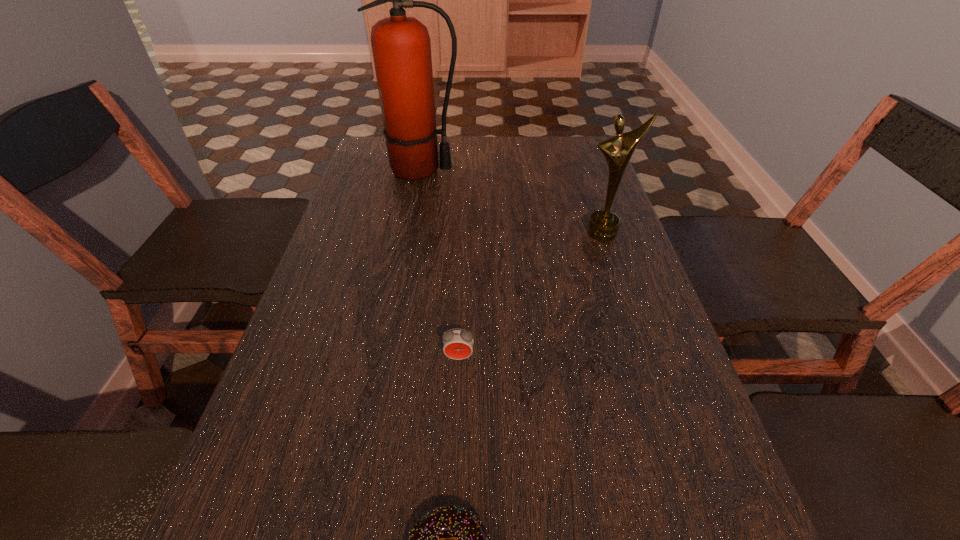
Where is `unoccupied position between the fire extinguisher and the alarm clock`? This screenshot has width=960, height=540. unoccupied position between the fire extinguisher and the alarm clock is located at coordinates (440, 264).

Find the location of a particular element. free space between the farthest object and the third shortest object is located at coordinates (512, 201).

This screenshot has height=540, width=960. What are the coordinates of `free space between the second farthest object and the alarm clock` in the screenshot? It's located at (531, 295).

You are a GUI agent. You are given a task and a screenshot of the screen. Output one action in this format:
    pyautogui.click(x=<x>, y=<y>)
    Task: Click on the object that is the nearest to the alarm clock
    The width and height of the screenshot is (960, 540).
    Given the screenshot: What is the action you would take?
    pyautogui.click(x=427, y=538)

Point out which object is positioned as the nearest to the second shortest object. Please provide its 2D coordinates. Your answer should be formatted as a tuple, i.e. [(x, y)], where the tuple contains the x and y coordinates of a point satisfying the conditions above.

[(427, 538)]